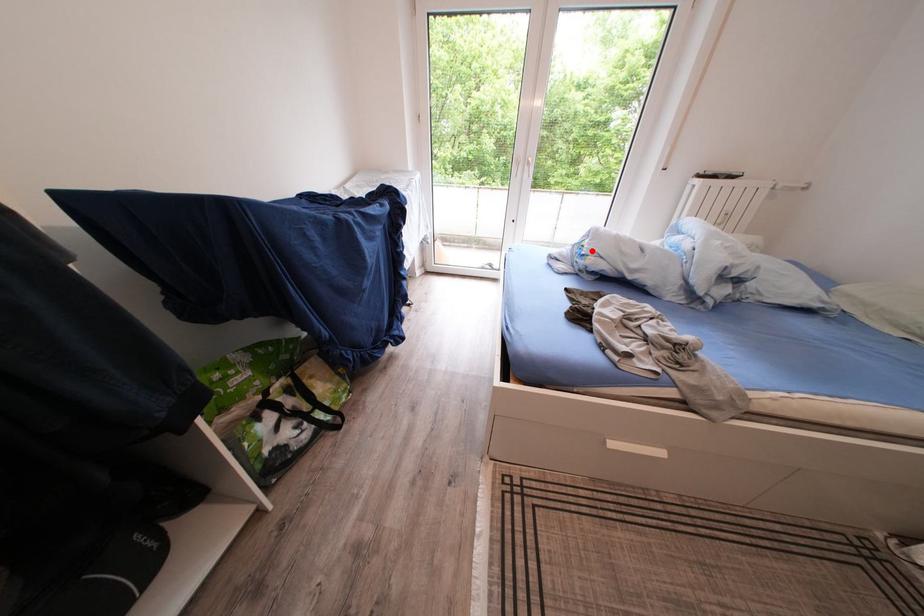
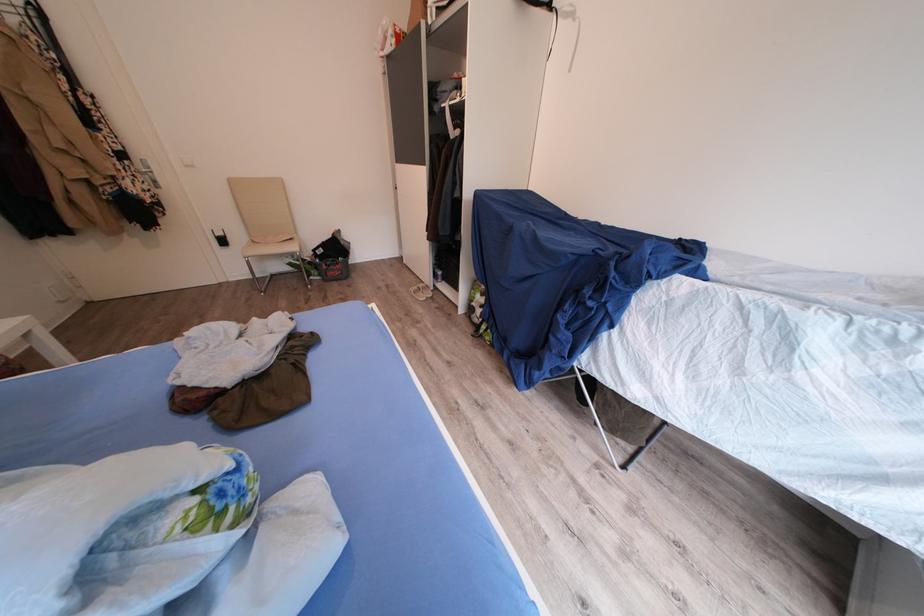
Question: I am providing you with two images of the same scene from different viewpoints. A red point is marked on the first image. At the location where the point appears in image 1, is it still visible in image 2?

Choices:
 (A) Yes
 (B) No

Answer: (A)